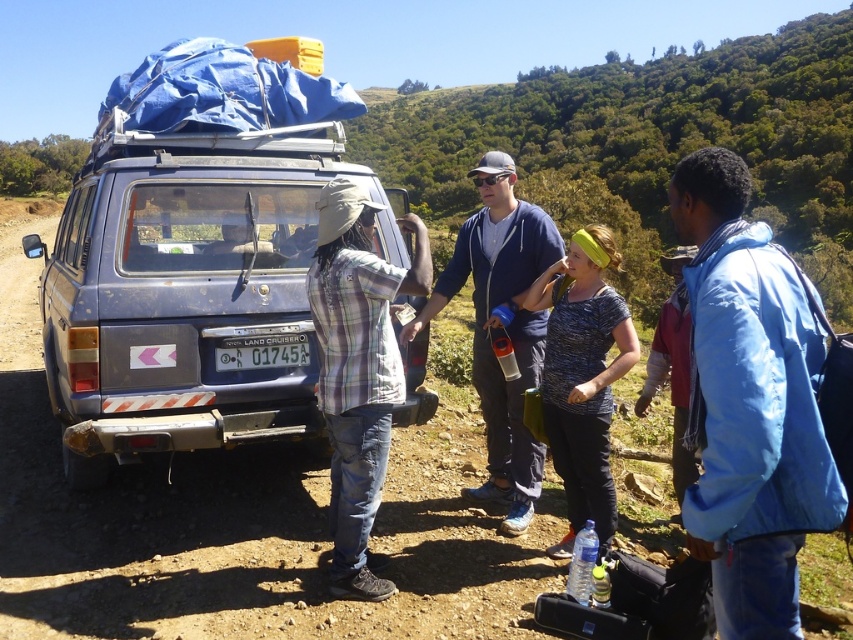
Measure the distance between printed cotton shirt at center and camera.

They are 11.50 feet apart.

Between printed cotton shirt at center and white plastic license plate at center, which one is positioned higher?

Positioned higher is white plastic license plate at center.

Locate an element on the screen. This screenshot has width=853, height=640. printed cotton shirt at center is located at coordinates (582, 376).

Where is `printed cotton shirt at center`? Image resolution: width=853 pixels, height=640 pixels. printed cotton shirt at center is located at coordinates click(x=582, y=376).

Is blue fabric jacket at right closer to camera compared to printed cotton shirt at center?

Yes, it is in front of printed cotton shirt at center.

Who is taller, blue fabric jacket at right or printed cotton shirt at center?

Standing taller between the two is blue fabric jacket at right.

Between point (683, 218) and point (573, 481), which one is positioned in front?

Point (683, 218) is more forward.

Locate an element on the screen. This screenshot has width=853, height=640. blue fabric jacket at right is located at coordinates (750, 404).

Measure the distance between plaid shirt at center and camera.

3.37 meters

Which of these two, plaid shirt at center or printed cotton shirt at center, stands taller?

plaid shirt at center

In the scene shown: Who is more distant from viewer, (399, 360) or (560, 403)?

Positioned behind is point (560, 403).

This screenshot has width=853, height=640. Identify the location of plaid shirt at center. (358, 369).